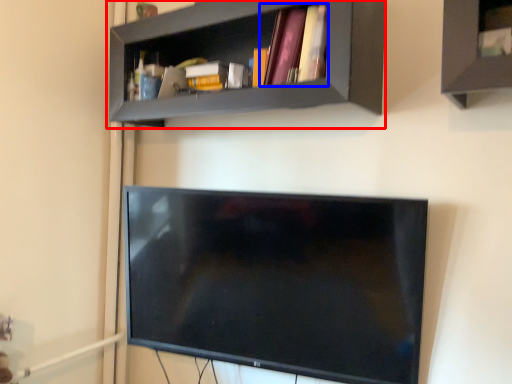
Question: Among these objects, which one is farthest to the camera, shelf (highlighted by a red box) or book (highlighted by a blue box)?

Choices:
 (A) shelf
 (B) book

Answer: (B)